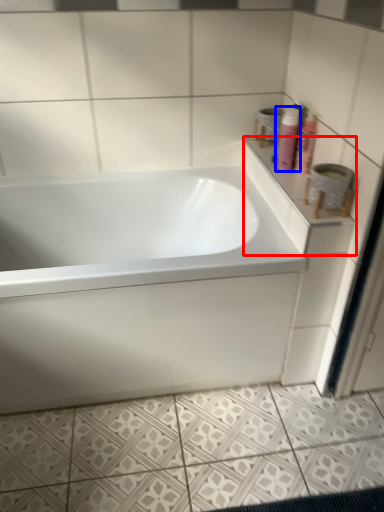
Question: Which object appears closest to the camera in this image, counter top (highlighted by a red box) or shaving cream (highlighted by a blue box)?

Choices:
 (A) counter top
 (B) shaving cream

Answer: (A)